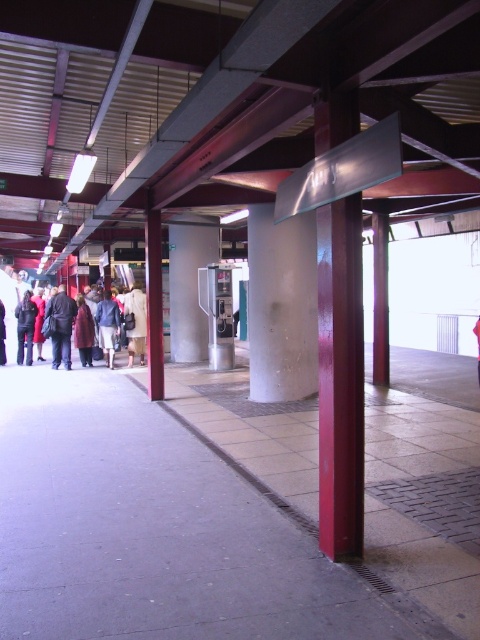
You are a traveler who just arrived at the station and see both the light beige coat at center and the dark blue denim jacket at center hanging on a rack. You want to choose the one that is taller to cover yourself better from the cold. Which one should you pick?

The light beige coat at center is taller than the dark blue denim jacket at center, so you should pick the light beige coat at center to cover yourself better from the cold.